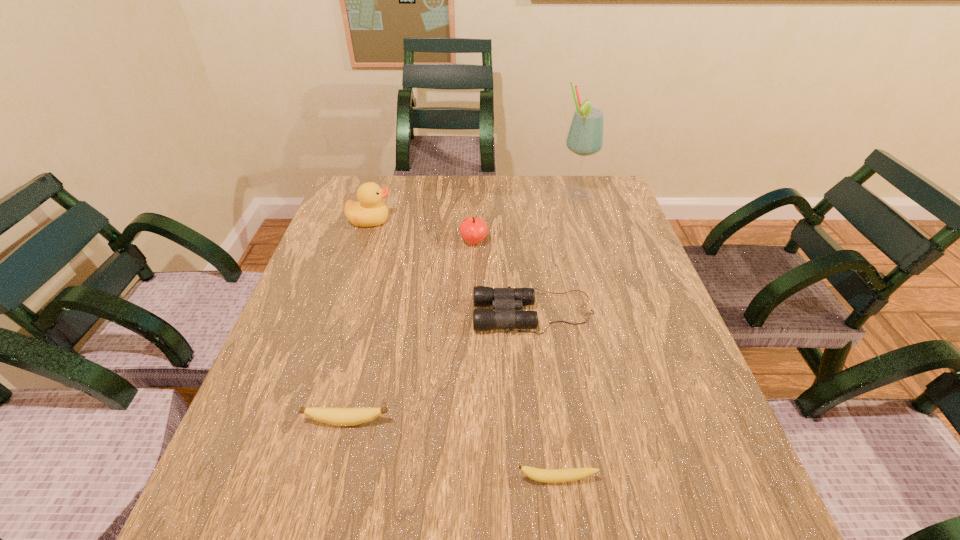
At what (x,y) coordinates should I click in order to perform the action: click on alcohol at the far edge. Please return your answer as a coordinate pair (x, y). The width and height of the screenshot is (960, 540). Looking at the image, I should click on (585, 137).

You are a GUI agent. You are given a task and a screenshot of the screen. Output one action in this format:
    pyautogui.click(x=<x>, y=<y>)
    Task: Click on the duck present at the far edge
    This screenshot has width=960, height=540.
    Given the screenshot: What is the action you would take?
    pyautogui.click(x=369, y=211)

At what (x,y) coordinates should I click in order to perform the action: click on duck that is at the left edge. Please return your answer as a coordinate pair (x, y). The image size is (960, 540). Looking at the image, I should click on coord(369,211).

The image size is (960, 540). In order to click on banana located in the left edge section of the desktop in this screenshot , I will do `click(335, 416)`.

Where is `object that is at the right edge`? The width and height of the screenshot is (960, 540). object that is at the right edge is located at coordinates (585, 137).

Locate an element on the screen. object that is at the far left corner is located at coordinates point(369,211).

At what (x,y) coordinates should I click in order to perform the action: click on object at the far right corner. Please return your answer as a coordinate pair (x, y). The height and width of the screenshot is (540, 960). Looking at the image, I should click on (585, 137).

In the image, there is a desktop. Where is `vacant space at the far edge`? The width and height of the screenshot is (960, 540). vacant space at the far edge is located at coordinates (406, 184).

In the image, there is a desktop. In order to click on vacant space at the near edge in this screenshot , I will do `click(624, 513)`.

In the image, there is a desktop. Where is `vacant space at the left edge`? vacant space at the left edge is located at coordinates (350, 327).